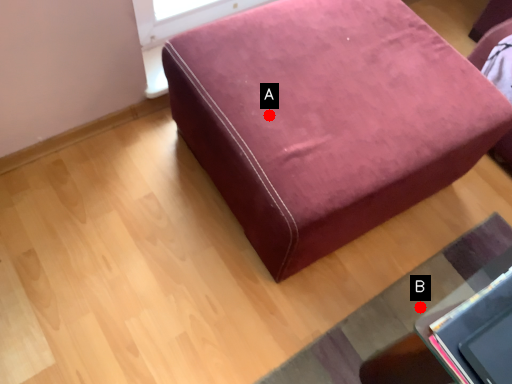
Question: Two points are circled on the image, labeled by A and B beside each circle. Among these points, which one is farthest from the camera?

Choices:
 (A) A is further
 (B) B is further

Answer: (B)